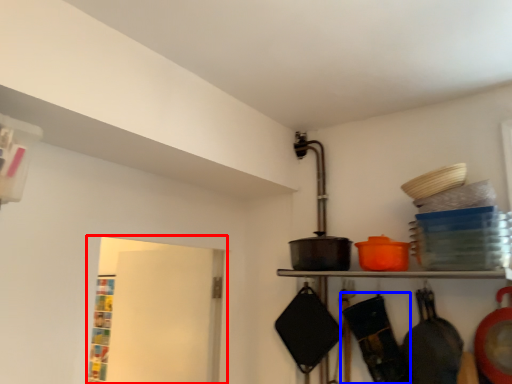
Question: Which point is further to the camera, window (highlighted by a red box) or frying pan (highlighted by a blue box)?

Choices:
 (A) window
 (B) frying pan

Answer: (A)